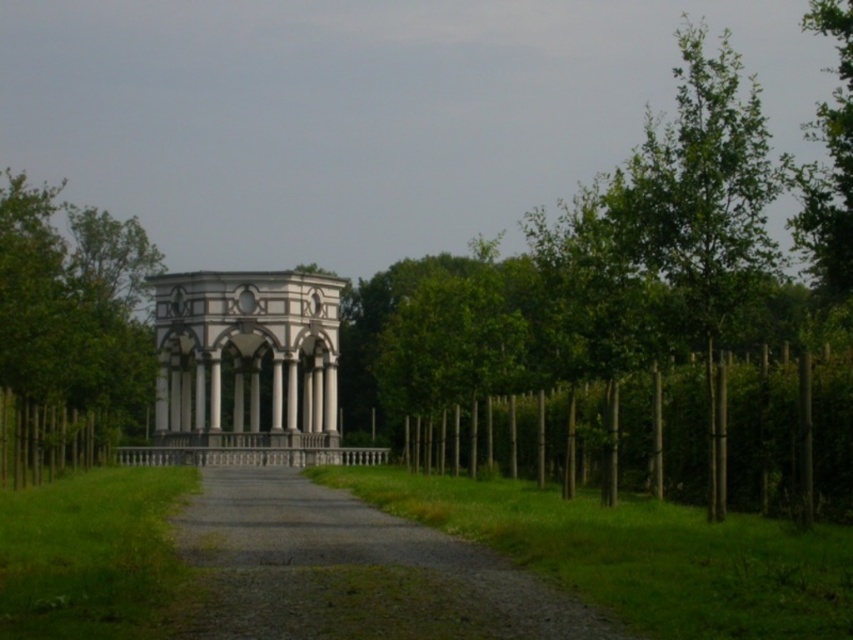
Question: Does green leafy hedge at right appear under green leafy tree at left?

Choices:
 (A) no
 (B) yes

Answer: (B)

Question: Which of these objects is positioned closest to the green leafy tree at upper right?

Choices:
 (A) gravelly path at center
 (B) white marble gazebo at center
 (C) green leafy tree at left

Answer: (A)

Question: Which point is closer to the camera?

Choices:
 (A) green leafy tree at left
 (B) white marble gazebo at center

Answer: (A)

Question: Which point appears farthest from the camera in this image?

Choices:
 (A) (827, 273)
 (B) (759, 464)
 (C) (57, 186)

Answer: (C)

Question: Does gravelly path at center have a greater width compared to white marble gazebo at center?

Choices:
 (A) yes
 (B) no

Answer: (A)

Question: From the image, what is the correct spatial relationship of gravelly path at center in relation to green leafy hedge at right?

Choices:
 (A) below
 (B) above

Answer: (A)